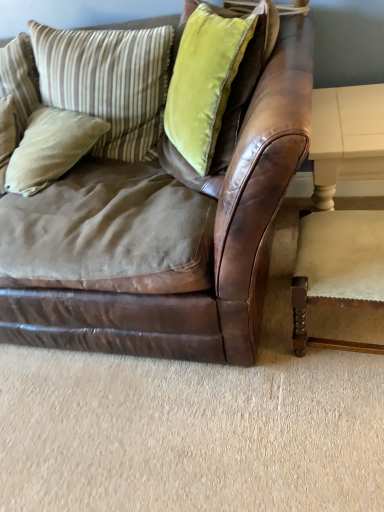
Question: Considering the relative sizes of brown leather couch at center and beige cotton pillow at left, the 2th pillow viewed from the left, in the image provided, is brown leather couch at center shorter than beige cotton pillow at left, the 2th pillow viewed from the left,?

Choices:
 (A) no
 (B) yes

Answer: (A)

Question: Is brown leather couch at center in front of beige cotton pillow at left, which is counted as the third pillow, starting from the right?

Choices:
 (A) yes
 (B) no

Answer: (A)

Question: From the image's perspective, would you say brown leather couch at center is shown under beige cotton pillow at left, which is counted as the third pillow, starting from the right?

Choices:
 (A) no
 (B) yes

Answer: (B)

Question: From a real-world perspective, is brown leather couch at center over beige cotton pillow at left, the 2th pillow viewed from the left?

Choices:
 (A) yes
 (B) no

Answer: (B)

Question: From the image's perspective, is brown leather couch at center above beige cotton pillow at left, the 2th pillow viewed from the left?

Choices:
 (A) yes
 (B) no

Answer: (B)

Question: Can you confirm if brown leather couch at center is thinner than beige cotton pillow at left, the 2th pillow viewed from the left?

Choices:
 (A) no
 (B) yes

Answer: (A)

Question: Considering the relative sizes of beige cotton pillow at left, which is counted as the third pillow, starting from the right, and striped fabric pillow at upper left, acting as the third pillow starting from the left, in the image provided, is beige cotton pillow at left, which is counted as the third pillow, starting from the right, thinner than striped fabric pillow at upper left, acting as the third pillow starting from the left,?

Choices:
 (A) no
 (B) yes

Answer: (A)

Question: Is there a large distance between beige cotton pillow at left, which is counted as the third pillow, starting from the right, and striped fabric pillow at upper left, acting as the third pillow starting from the left?

Choices:
 (A) yes
 (B) no

Answer: (B)

Question: From the image's perspective, is beige cotton pillow at left, which is counted as the third pillow, starting from the right, under striped fabric pillow at upper left, which ranks as the 2th pillow in right-to-left order?

Choices:
 (A) yes
 (B) no

Answer: (A)

Question: Does beige cotton pillow at left, which is counted as the third pillow, starting from the right, have a smaller size compared to striped fabric pillow at upper left, which ranks as the 2th pillow in right-to-left order?

Choices:
 (A) no
 (B) yes

Answer: (B)

Question: Does beige cotton pillow at left, which is counted as the third pillow, starting from the right, come in front of striped fabric pillow at upper left, which ranks as the 2th pillow in right-to-left order?

Choices:
 (A) yes
 (B) no

Answer: (B)

Question: Is beige cotton pillow at left, which is counted as the third pillow, starting from the right, to the left of striped fabric pillow at upper left, which ranks as the 2th pillow in right-to-left order, from the viewer's perspective?

Choices:
 (A) no
 (B) yes

Answer: (B)

Question: Does striped fabric pillow at upper left, acting as the third pillow starting from the left, have a lesser height compared to striped fabric pillow at upper left, which ranks as the 4th pillow in right-to-left order?

Choices:
 (A) no
 (B) yes

Answer: (A)